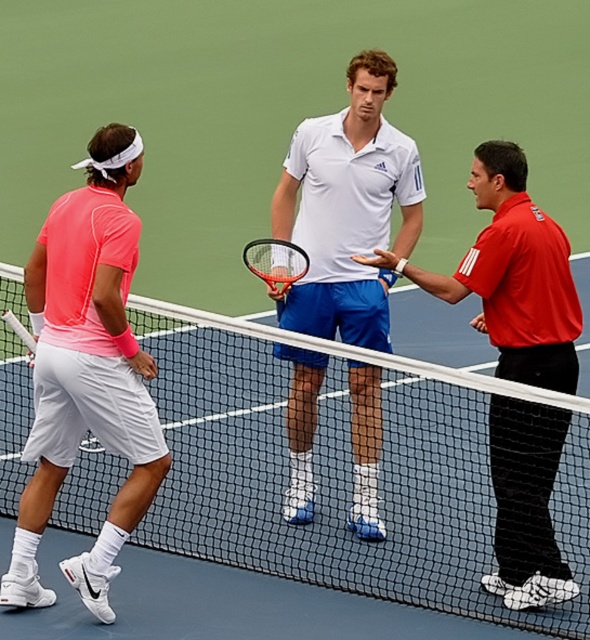
Question: Which point appears farthest from the camera in this image?

Choices:
 (A) (445, 502)
 (B) (32, 342)
 (C) (273, 253)
 (D) (307, 444)

Answer: (C)

Question: Which of the following is the farthest from the observer?

Choices:
 (A) (499, 256)
 (B) (34, 339)
 (C) (440, 593)
 (D) (299, 248)

Answer: (D)

Question: Can you confirm if matte pink shirt at left is bigger than orange matte tennis racket at center?

Choices:
 (A) no
 (B) yes

Answer: (B)

Question: Estimate the real-world distances between objects in this image. Which object is farther from the black mesh tennis net at center?

Choices:
 (A) matte black tennis racket at left
 (B) white matte tennis racket at center
 (C) orange matte tennis racket at center

Answer: (A)

Question: Is matte red shirt at right closer to camera compared to orange matte tennis racket at center?

Choices:
 (A) yes
 (B) no

Answer: (A)

Question: Can you confirm if matte red shirt at right is positioned above matte black tennis racket at left?

Choices:
 (A) no
 (B) yes

Answer: (A)